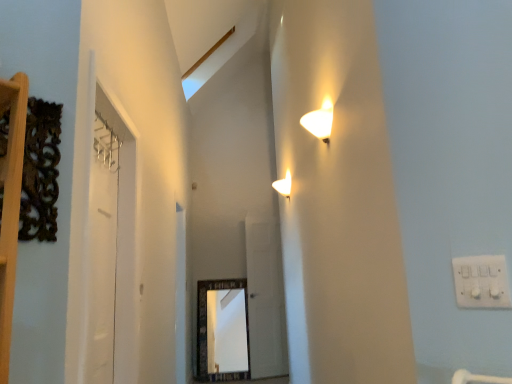
Question: Does transparent glass door at center, which is the second glass door from left to right, come in front of white plastic electric outlet at upper right?

Choices:
 (A) no
 (B) yes

Answer: (A)

Question: Would you consider transparent glass door at center, placed as the 1th glass door when sorted from back to front, to be distant from white plastic electric outlet at upper right?

Choices:
 (A) no
 (B) yes

Answer: (B)

Question: Is the depth of transparent glass door at center, which is the second glass door from left to right, greater than that of white plastic electric outlet at upper right?

Choices:
 (A) no
 (B) yes

Answer: (B)

Question: From the image's perspective, would you say transparent glass door at center, which is the second glass door from left to right, is positioned over white plastic electric outlet at upper right?

Choices:
 (A) yes
 (B) no

Answer: (B)

Question: Considering the relative sizes of transparent glass door at center, placed as the 1th glass door when sorted from back to front, and white plastic electric outlet at upper right in the image provided, is transparent glass door at center, placed as the 1th glass door when sorted from back to front, smaller than white plastic electric outlet at upper right?

Choices:
 (A) yes
 (B) no

Answer: (B)

Question: Is white plastic electric outlet at upper right completely or partially inside transparent glass door at center, placed as the 1th glass door when sorted from back to front?

Choices:
 (A) yes
 (B) no

Answer: (B)

Question: From the image's perspective, is white glossy door at left on top of clear glass door at left, which appears as the 1th glass door when viewed from the front?

Choices:
 (A) yes
 (B) no

Answer: (B)

Question: Is white glossy door at left touching clear glass door at left, which appears as the 1th glass door when viewed from the front?

Choices:
 (A) no
 (B) yes

Answer: (B)

Question: From a real-world perspective, is white glossy door at left on clear glass door at left, the second glass door positioned from the back?

Choices:
 (A) no
 (B) yes

Answer: (A)

Question: Can you confirm if white glossy door at left is smaller than clear glass door at left, the second glass door positioned from the back?

Choices:
 (A) no
 (B) yes

Answer: (B)

Question: Is the position of white glossy door at left less distant than that of clear glass door at left, which is counted as the 1th glass door, starting from the left?

Choices:
 (A) no
 (B) yes

Answer: (A)

Question: From the image's perspective, is white glossy door at left located beneath clear glass door at left, which is counted as the 1th glass door, starting from the left?

Choices:
 (A) no
 (B) yes

Answer: (B)

Question: Does transparent glass door at center, which is the second glass door from left to right, lie in front of clear glass door at left, arranged as the 2th glass door when viewed from the right?

Choices:
 (A) no
 (B) yes

Answer: (A)